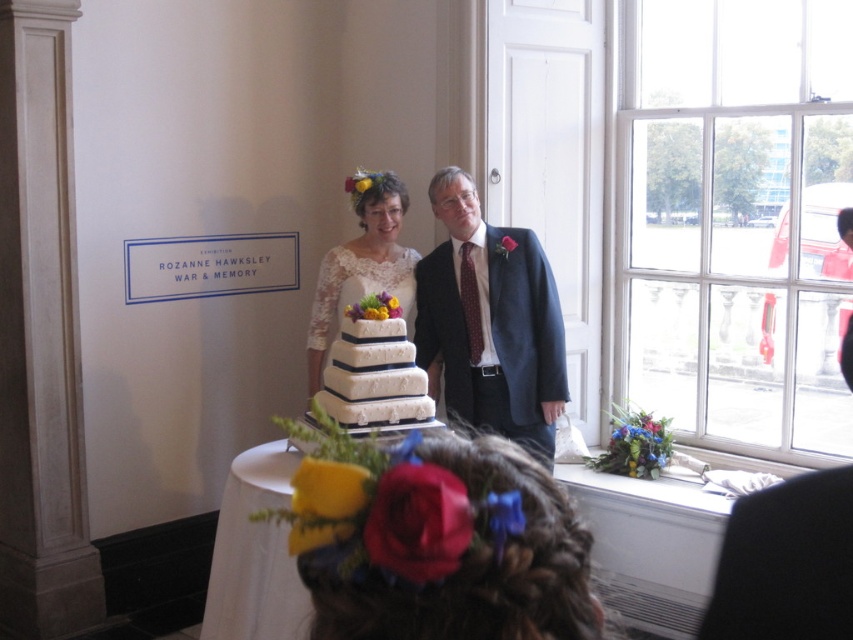
Question: In this image, where is dark blue suit at center located relative to white lace dress at center?

Choices:
 (A) right
 (B) left

Answer: (A)

Question: Among these objects, which one is farthest from the camera?

Choices:
 (A) lace/embroidered wedding dress at center
 (B) white lace dress at center

Answer: (B)

Question: Can you confirm if white textured cake at center is bigger than lace/embroidered wedding dress at center?

Choices:
 (A) no
 (B) yes

Answer: (A)

Question: Which point appears farthest from the camera in this image?

Choices:
 (A) (434, 205)
 (B) (374, 317)

Answer: (A)

Question: Which object appears farthest from the camera in this image?

Choices:
 (A) dark blue suit at center
 (B) lace/embroidered wedding dress at center
 (C) white lace dress at center
 (D) white textured cake at center

Answer: (C)

Question: Can you confirm if white textured cake at center is smaller than lace/embroidered wedding dress at center?

Choices:
 (A) no
 (B) yes

Answer: (B)